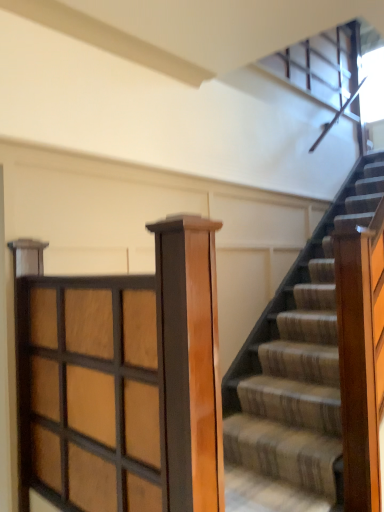
Question: Should I look upward or downward to see wooden grid at center?

Choices:
 (A) down
 (B) up

Answer: (A)